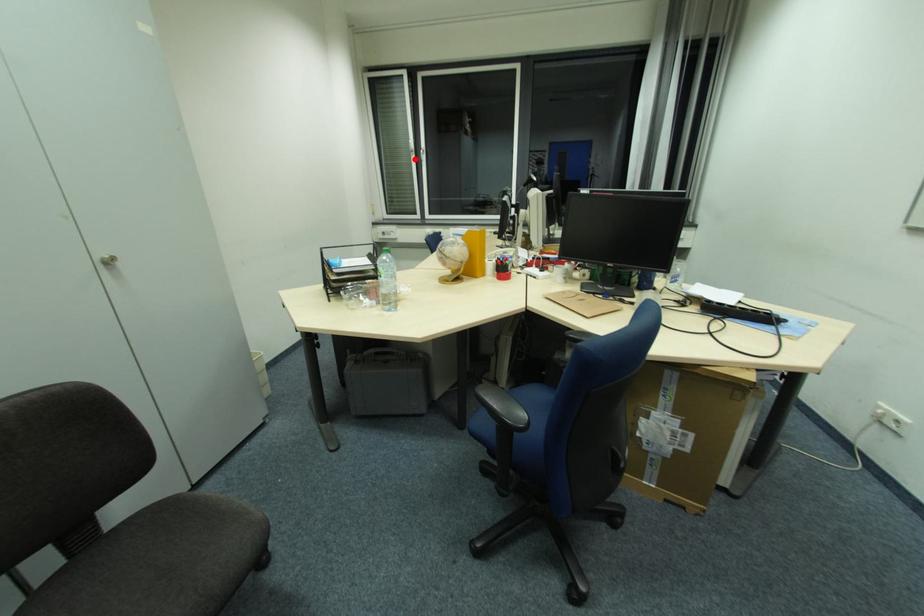
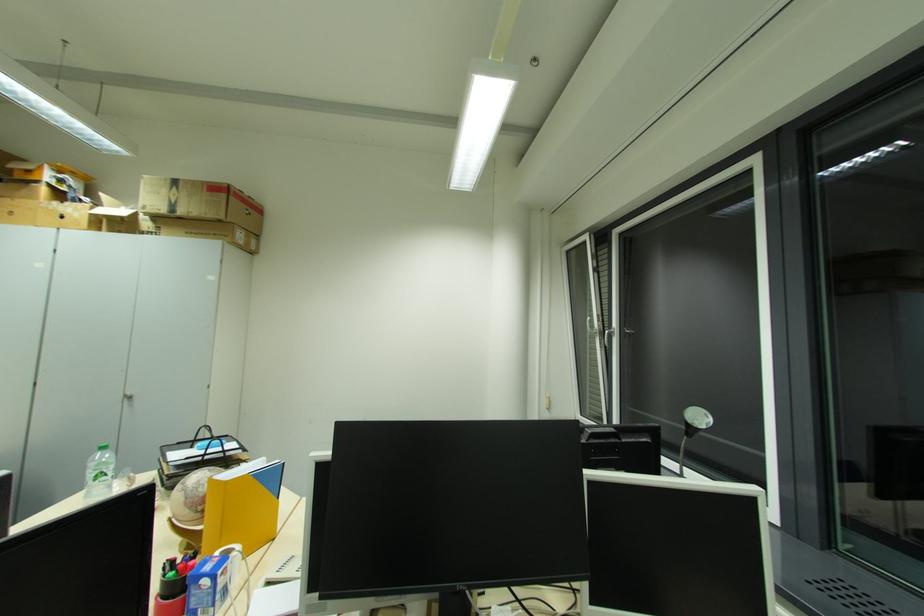
Question: I am providing you with two images of the same scene from different viewpoints. A red point is marked on the first image. Can you still see the location of the red point in image 2?

Choices:
 (A) Yes
 (B) No

Answer: (A)